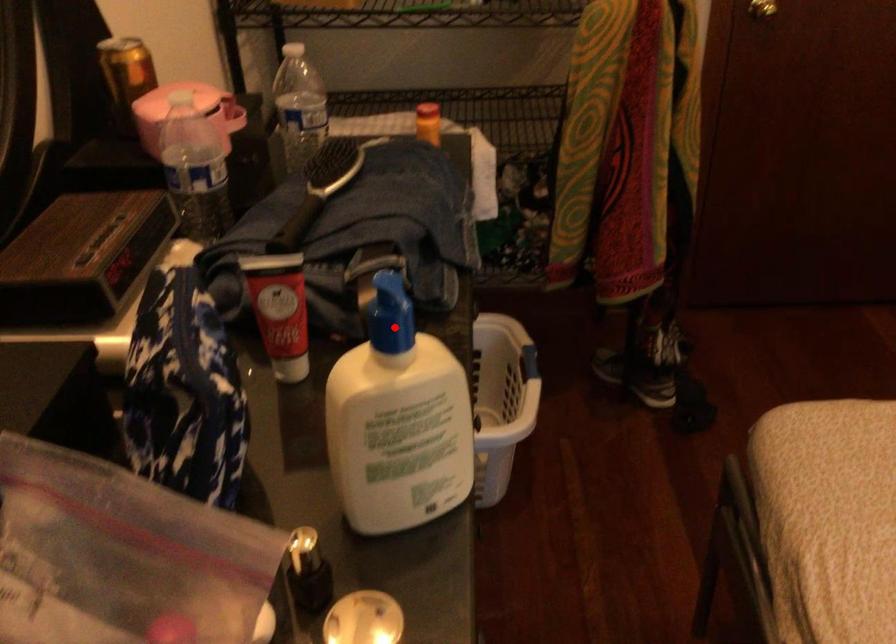
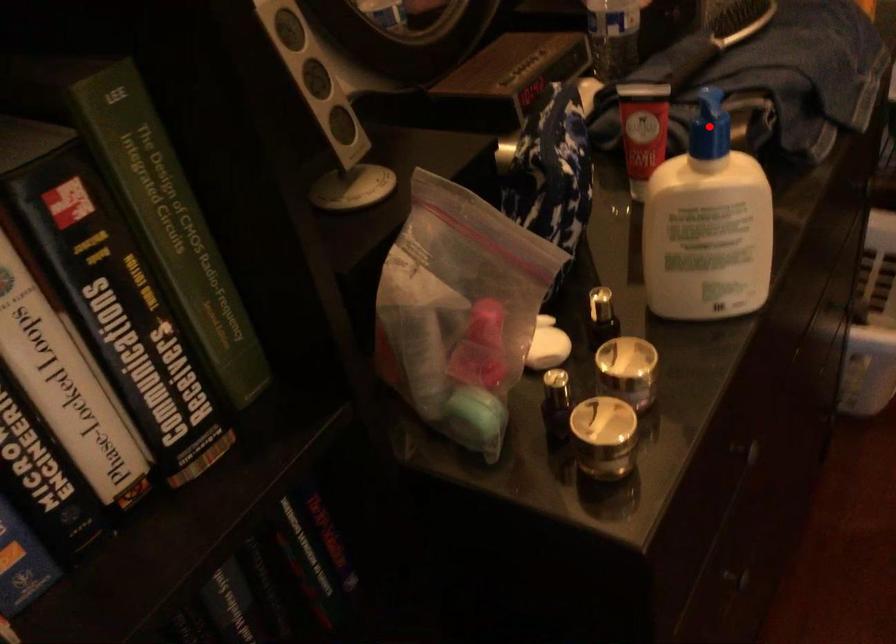
I am providing you with two images of the same scene from different viewpoints. A red point is marked on the first image and another point is marked on the second image. Are the points marked in image1 and image2 representing the same 3D position?

Yes